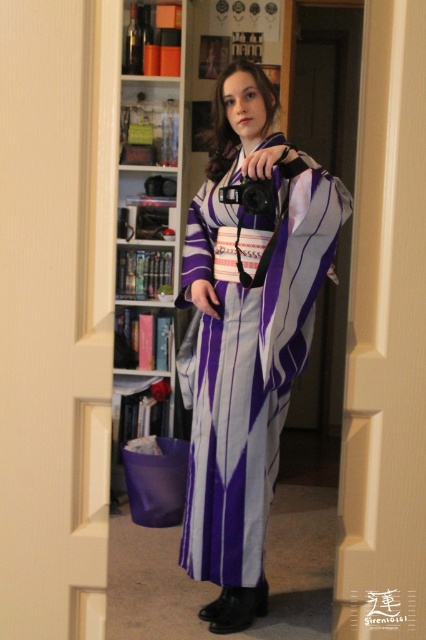
Between purple silk kimono at center and black plastic camera at center, which one appears on the left side from the viewer's perspective?

Positioned to the left is black plastic camera at center.

Which is in front, point (264, 369) or point (256, 212)?

Point (264, 369) is in front.

Where is `purple silk kimono at center`? purple silk kimono at center is located at coordinates (247, 336).

Is white wooden bookshelf at center below black plastic camera at center?

No, white wooden bookshelf at center is not below black plastic camera at center.

Does white wooden bookshelf at center have a lesser height compared to black plastic camera at center?

No, white wooden bookshelf at center is not shorter than black plastic camera at center.

Identify the location of white wooden bookshelf at center. (149, 224).

Identify the location of white wooden bookshelf at center. (149, 224).

Who is taller, purple silk kimono at center or white wooden bookshelf at center?

white wooden bookshelf at center

From the picture: Can you confirm if purple silk kimono at center is shorter than white wooden bookshelf at center?

Correct, purple silk kimono at center is not as tall as white wooden bookshelf at center.

Between point (206, 353) and point (164, 99), which one is positioned behind?

The point (164, 99) is more distant.

What are the coordinates of `purple silk kimono at center` in the screenshot? It's located at (247, 336).